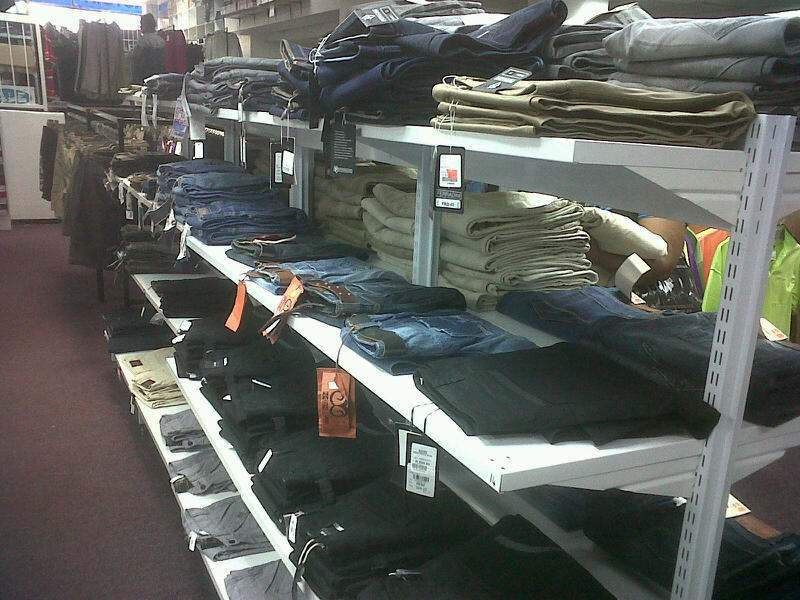
The image size is (800, 600). In order to click on bottom white shelf in this screenshot , I will do `click(198, 496)`.